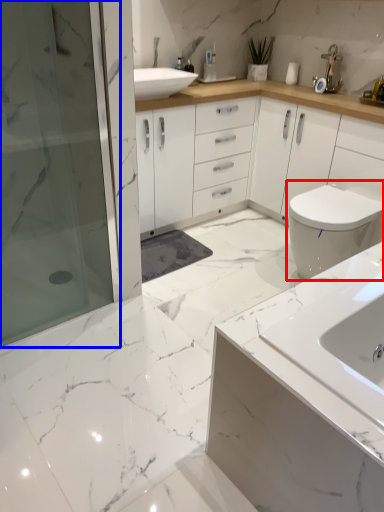
Question: Among these objects, which one is nearest to the camera, toilet (highlighted by a red box) or shower door (highlighted by a blue box)?

Choices:
 (A) toilet
 (B) shower door

Answer: (B)